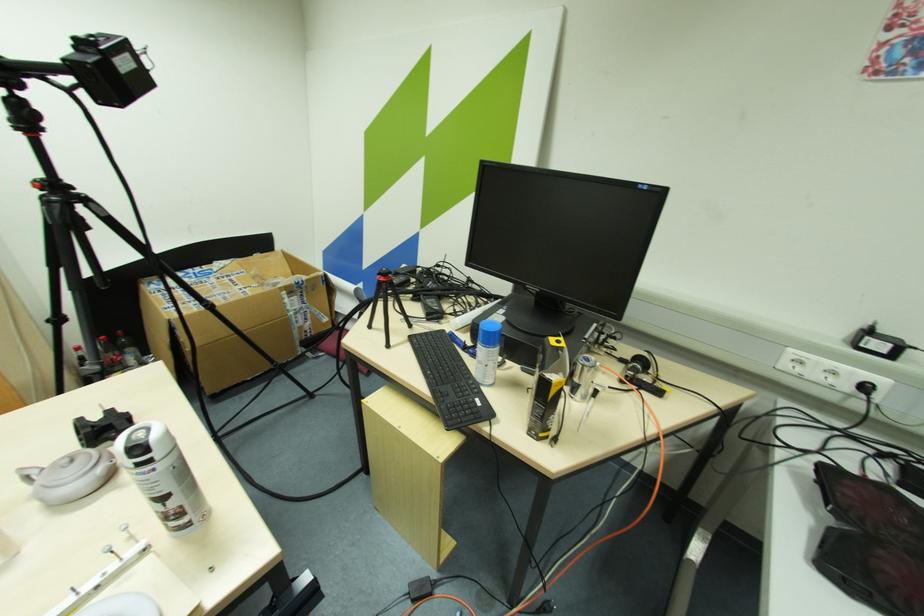
Where is `white spray can`? white spray can is located at coordinates (162, 477).